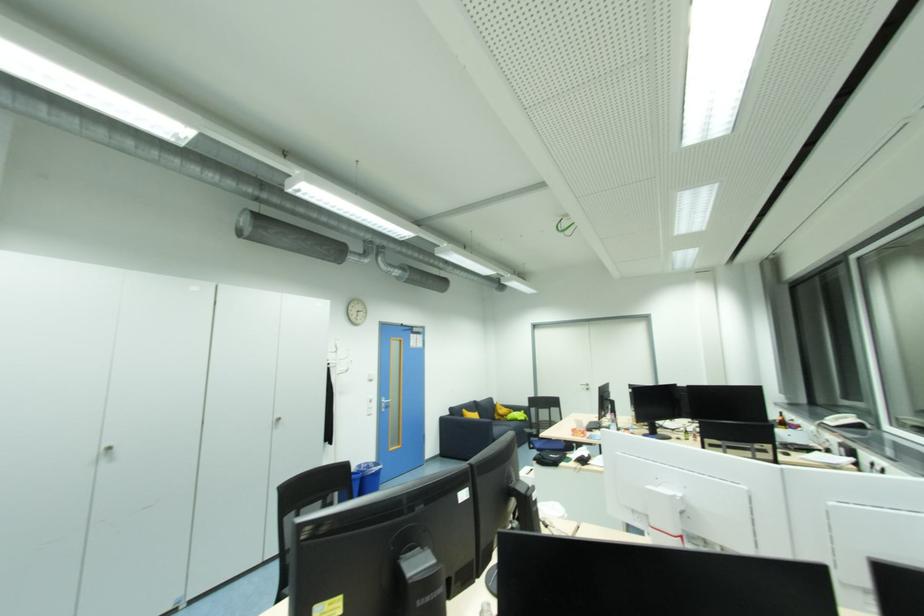
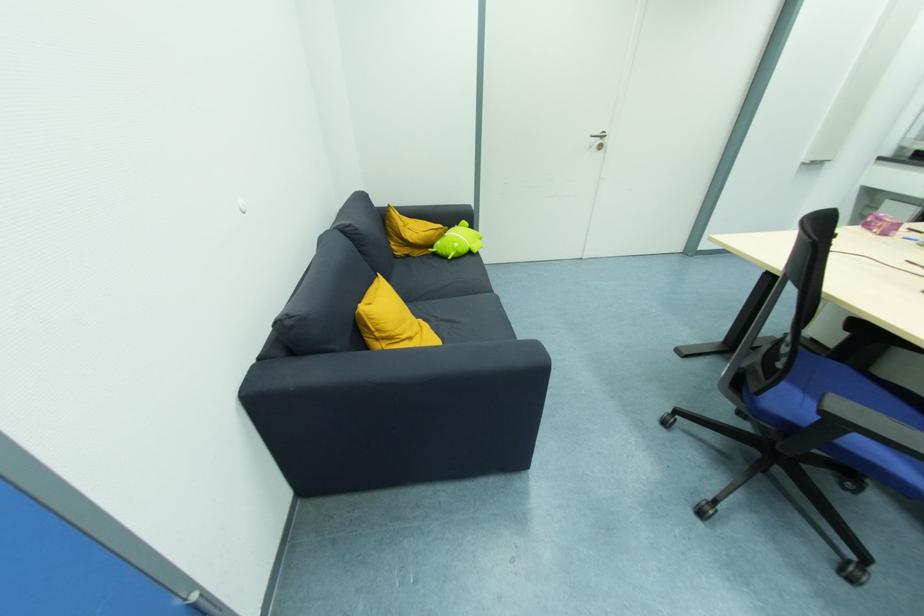
Where in the second image is the point corresponding to (590,391) from the first image?

(603, 148)